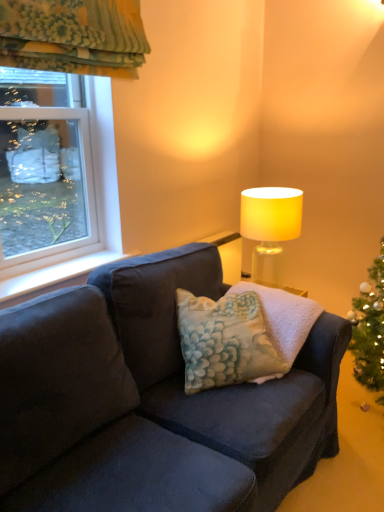
Question: Can you confirm if clear glass window at upper left is positioned to the left of fluffy fabric pillow at center?

Choices:
 (A) no
 (B) yes

Answer: (B)

Question: Does clear glass window at upper left touch fluffy fabric pillow at center?

Choices:
 (A) no
 (B) yes

Answer: (A)

Question: Would you say clear glass window at upper left is outside fluffy fabric pillow at center?

Choices:
 (A) no
 (B) yes

Answer: (B)

Question: Is clear glass window at upper left further to camera compared to fluffy fabric pillow at center?

Choices:
 (A) yes
 (B) no

Answer: (A)

Question: Can you confirm if clear glass window at upper left is positioned to the right of fluffy fabric pillow at center?

Choices:
 (A) yes
 (B) no

Answer: (B)

Question: Is clear glass window at upper left situated inside matte yellow lampshade at upper right or outside?

Choices:
 (A) inside
 (B) outside

Answer: (B)

Question: From the image's perspective, relative to matte yellow lampshade at upper right, is clear glass window at upper left above or below?

Choices:
 (A) above
 (B) below

Answer: (A)

Question: Considering the positions of clear glass window at upper left and matte yellow lampshade at upper right in the image, is clear glass window at upper left taller or shorter than matte yellow lampshade at upper right?

Choices:
 (A) short
 (B) tall

Answer: (B)

Question: Looking at the image, does clear glass window at upper left seem bigger or smaller compared to matte yellow lampshade at upper right?

Choices:
 (A) small
 (B) big

Answer: (A)

Question: Is point (289, 200) positioned closer to the camera than point (31, 289)?

Choices:
 (A) closer
 (B) farther

Answer: (B)

Question: From the image's perspective, is matte yellow lampshade at upper right above or below white smooth window sill at left?

Choices:
 (A) below
 (B) above

Answer: (B)

Question: In terms of height, does matte yellow lampshade at upper right look taller or shorter compared to white smooth window sill at left?

Choices:
 (A) short
 (B) tall

Answer: (B)

Question: Looking at the image, does matte yellow lampshade at upper right seem bigger or smaller compared to white smooth window sill at left?

Choices:
 (A) small
 (B) big

Answer: (B)

Question: In terms of width, does matte yellow lampshade at upper right look wider or thinner when compared to clear glass window at upper left?

Choices:
 (A) wide
 (B) thin

Answer: (A)

Question: Is matte yellow lampshade at upper right taller or shorter than clear glass window at upper left?

Choices:
 (A) tall
 (B) short

Answer: (B)